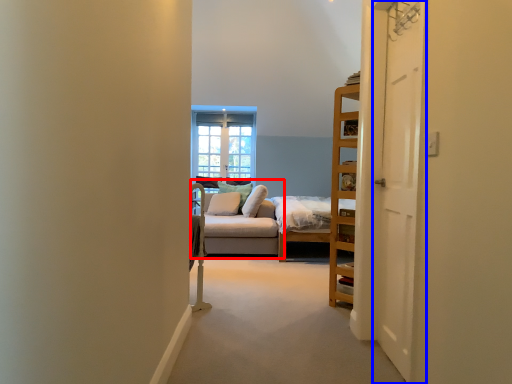
Question: Which of the following is the closest to the observer, studio couch (highlighted by a red box) or door (highlighted by a blue box)?

Choices:
 (A) studio couch
 (B) door

Answer: (B)